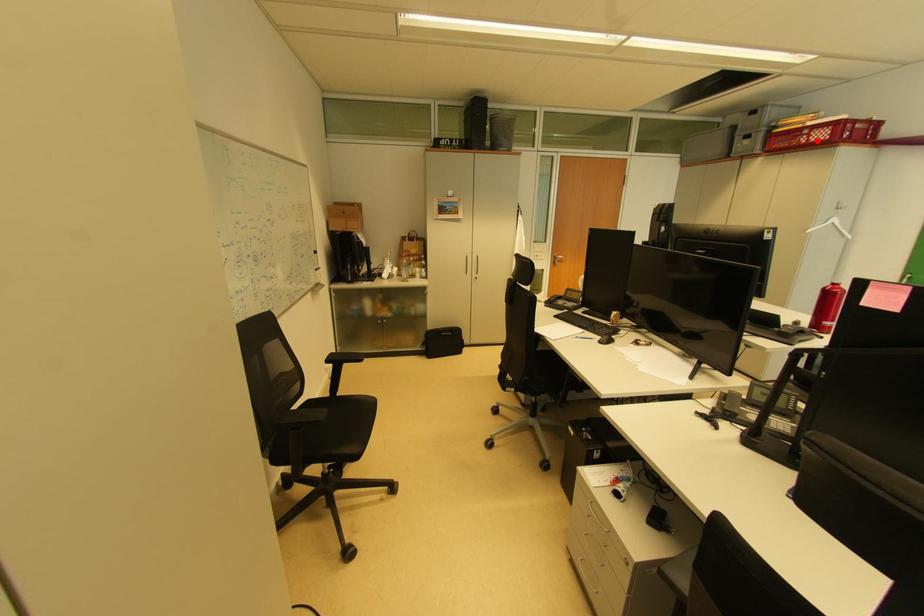
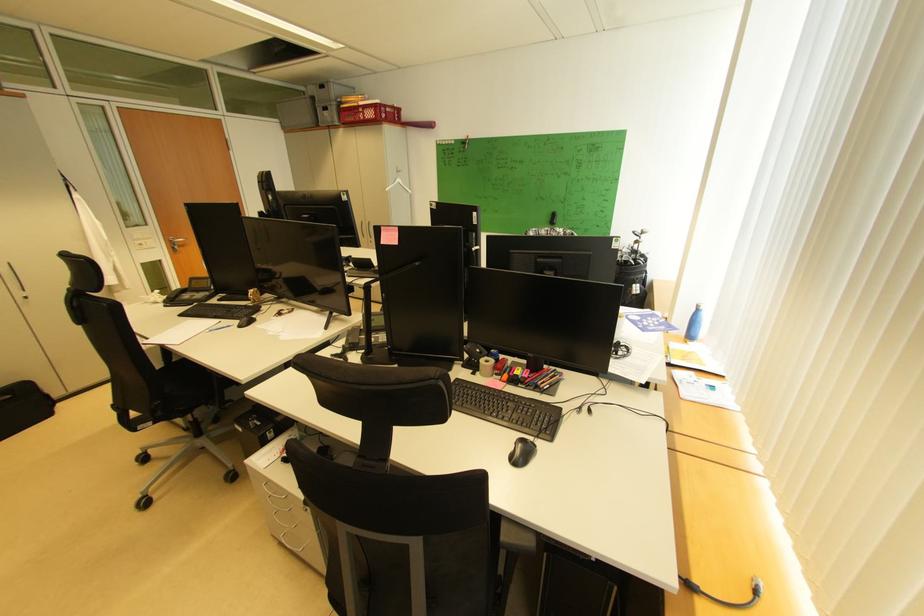
The point at the highlighted location is marked in the first image. Where is the corresponding point in the second image?

(372, 118)